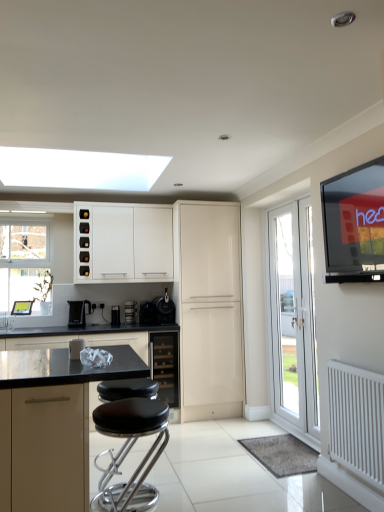
Question: Does satin black wine cooler at center, which is counted as the 2th appliance, starting from the right, have a greater height compared to black plastic coffee machine at lower left?

Choices:
 (A) no
 (B) yes

Answer: (A)

Question: Considering the relative sizes of satin black wine cooler at center, which is counted as the 2th appliance, starting from the right, and black plastic coffee machine at lower left in the image provided, is satin black wine cooler at center, which is counted as the 2th appliance, starting from the right, thinner than black plastic coffee machine at lower left?

Choices:
 (A) yes
 (B) no

Answer: (B)

Question: From a real-world perspective, does satin black wine cooler at center, which is the 3th appliance in left-to-right order, stand above black plastic coffee machine at lower left?

Choices:
 (A) yes
 (B) no

Answer: (B)

Question: Are satin black wine cooler at center, which is the 3th appliance in left-to-right order, and black plastic coffee machine at lower left far apart?

Choices:
 (A) yes
 (B) no

Answer: (B)

Question: From a real-world perspective, is satin black wine cooler at center, which is the 3th appliance in left-to-right order, physically below black plastic coffee machine at lower left?

Choices:
 (A) yes
 (B) no

Answer: (A)

Question: From the image's perspective, would you say satin black wine cooler at center, which is the 3th appliance in left-to-right order, is shown under black plastic coffee machine at lower left?

Choices:
 (A) no
 (B) yes

Answer: (B)

Question: Is black leather stool at center positioned far away from flat-screen tv at upper right?

Choices:
 (A) no
 (B) yes

Answer: (B)

Question: Is black leather stool at center further to camera compared to flat-screen tv at upper right?

Choices:
 (A) no
 (B) yes

Answer: (B)

Question: Is flat-screen tv at upper right inside black leather stool at center?

Choices:
 (A) yes
 (B) no

Answer: (B)

Question: Is black leather stool at center positioned before flat-screen tv at upper right?

Choices:
 (A) no
 (B) yes

Answer: (A)

Question: From a real-world perspective, is black leather stool at center under flat-screen tv at upper right?

Choices:
 (A) no
 (B) yes

Answer: (B)

Question: From the image's perspective, is black leather stool at center located above flat-screen tv at upper right?

Choices:
 (A) yes
 (B) no

Answer: (B)

Question: From a real-world perspective, does black plastic coffee machine at lower left sit lower than white glossy door at right?

Choices:
 (A) no
 (B) yes

Answer: (A)